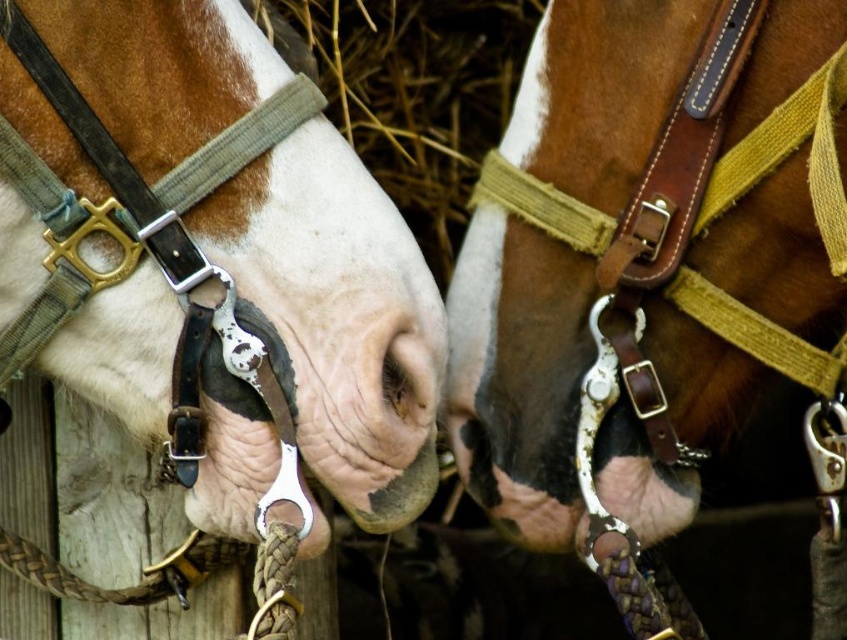
Which is more to the left, brown leather halter at center or matte black nose at center?

matte black nose at center is more to the left.

Who is more forward, (794, 49) or (386, 401)?

Point (794, 49)

In order to click on brown leather halter at center in this screenshot , I will do `click(646, 253)`.

Is matte black halter at left shorter than matte black nose at center?

In fact, matte black halter at left may be taller than matte black nose at center.

Measure the distance between point [389,484] and camera.

Point [389,484] is 1.29 meters from camera.

Where is `matte black halter at left`? This screenshot has height=640, width=847. matte black halter at left is located at coordinates (209, 260).

Between matte black halter at left and brown leather halter at center, which one has less height?

matte black halter at left

Does matte black halter at left have a greater width compared to brown leather halter at center?

Indeed, matte black halter at left has a greater width compared to brown leather halter at center.

Locate an element on the screen. The height and width of the screenshot is (640, 847). matte black halter at left is located at coordinates pos(209,260).